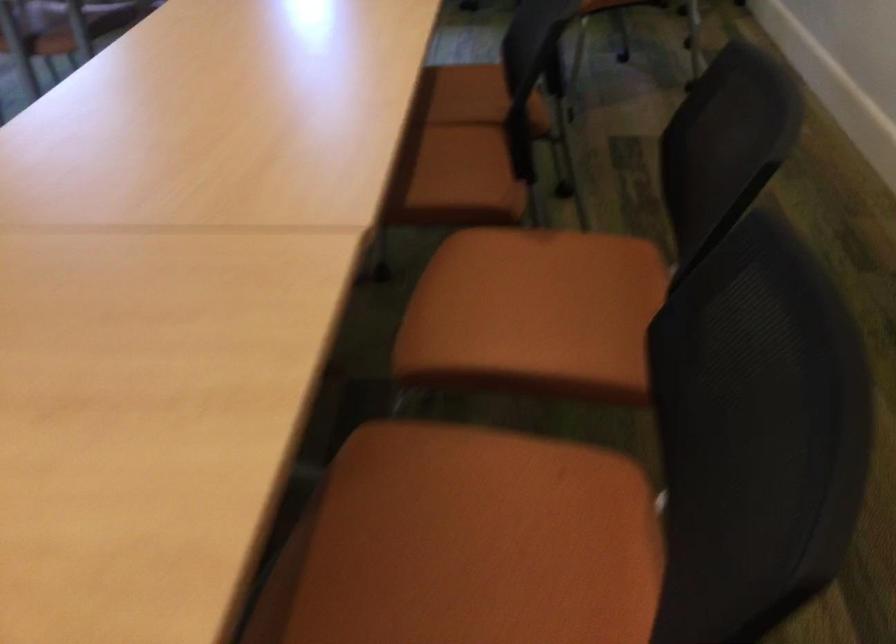
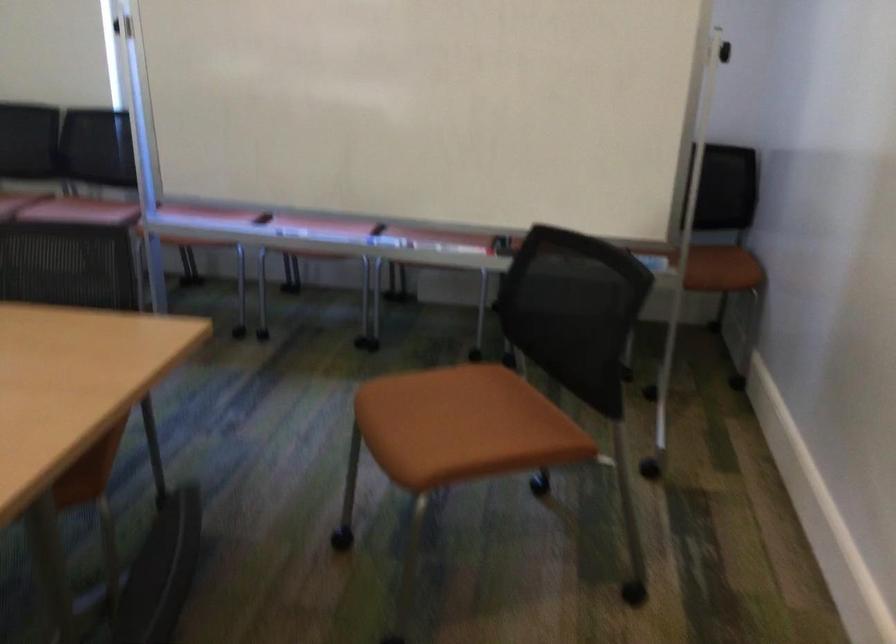
Question: What movement of the cameraman would produce the second image?

Choices:
 (A) Left
 (B) Right
 (C) Forward
 (D) Backward

Answer: (D)